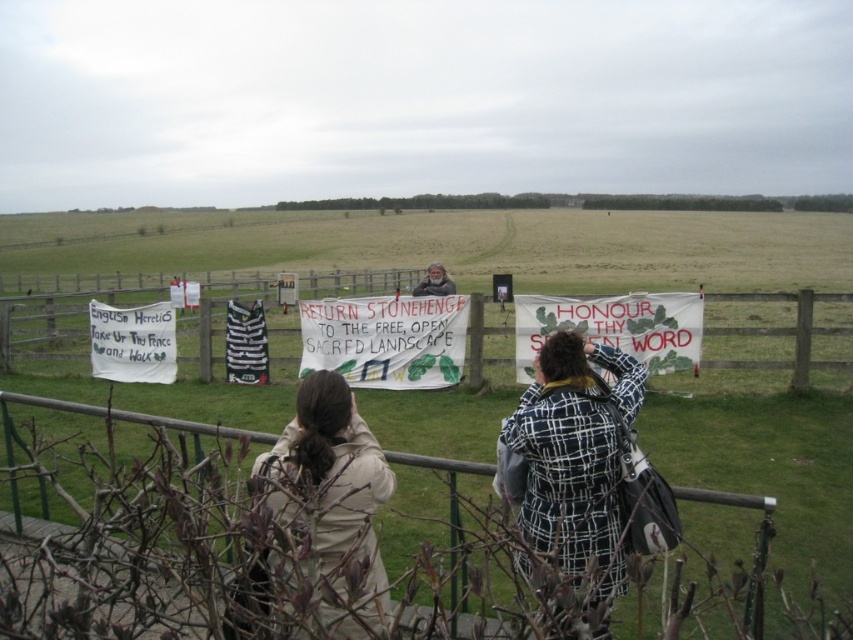
Question: Can you confirm if white fabric banner at center is smaller than light brown wooden sign at center?

Choices:
 (A) yes
 (B) no

Answer: (A)

Question: Is plaid wool coat at center behind white fabric banner at center?

Choices:
 (A) no
 (B) yes

Answer: (A)

Question: Does wooden fence at lower center have a greater width compared to green metal rail at lower center?

Choices:
 (A) no
 (B) yes

Answer: (B)

Question: Among these objects, which one is nearest to the camera?

Choices:
 (A) plaid wool coat at center
 (B) green metal rail at lower center

Answer: (A)

Question: Which object is closer to the camera taking this photo?

Choices:
 (A) light brown wooden sign at center
 (B) plaid wool coat at center
 (C) green fabric banner at center

Answer: (B)

Question: Estimate the real-world distances between objects in this image. Which object is farther from the green fabric banner at center?

Choices:
 (A) white paper sign at left
 (B) light brown wooden sign at center
 (C) wooden fence at lower center
 (D) white fabric banner at center

Answer: (A)